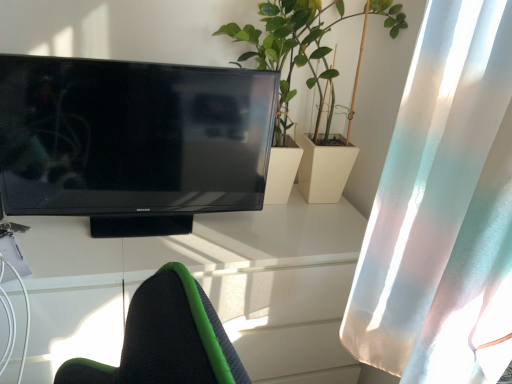
Locate an element on the screen. free space in front of green leafy plant at center is located at coordinates (279, 230).